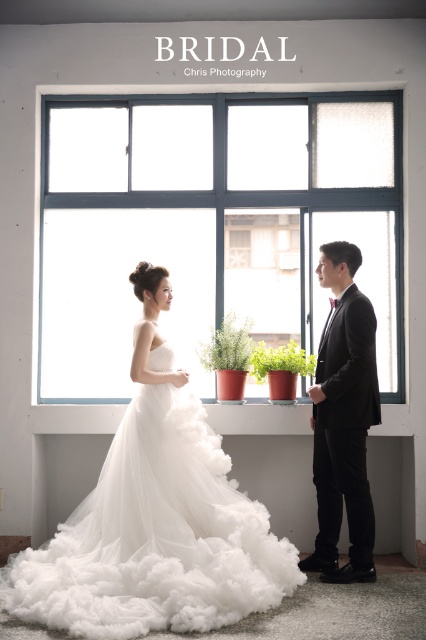
Question: Does white tulle dress at center have a greater width compared to black satin suit at right?

Choices:
 (A) no
 (B) yes

Answer: (B)

Question: Which point is closer to the camera taking this photo?

Choices:
 (A) (x=282, y=209)
 (B) (x=370, y=385)
 (C) (x=229, y=593)

Answer: (C)

Question: Which object appears closest to the camera in this image?

Choices:
 (A) black satin suit at right
 (B) clear glass window at center

Answer: (A)

Question: Does clear glass window at center appear on the left side of white tulle dress at center?

Choices:
 (A) yes
 (B) no

Answer: (B)

Question: Where is white tulle dress at center located in relation to black satin suit at right in the image?

Choices:
 (A) left
 (B) right

Answer: (A)

Question: Which object is positioned farthest from the white tulle dress at center?

Choices:
 (A) clear glass window at center
 (B) black satin suit at right

Answer: (A)